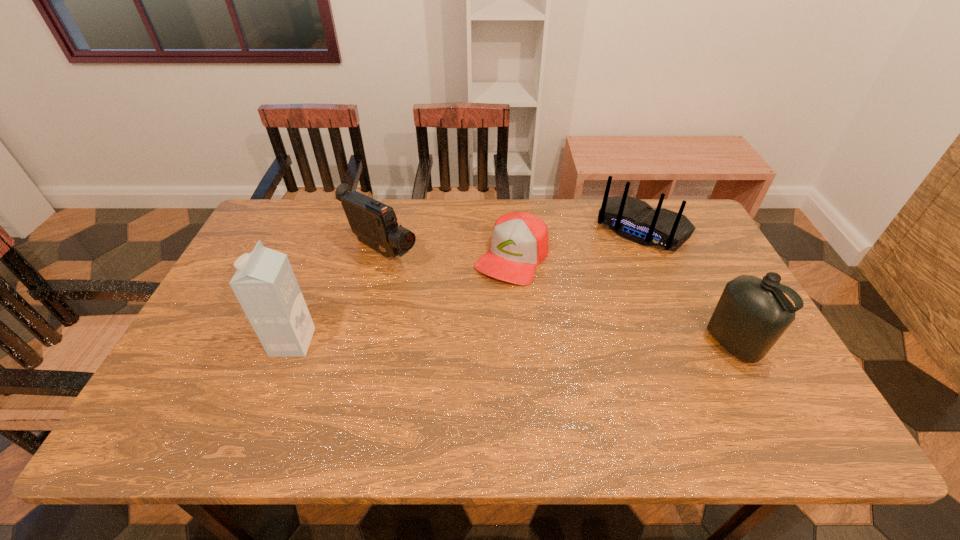
Locate an element on the screen. This screenshot has width=960, height=540. the tallest object is located at coordinates (265, 285).

This screenshot has width=960, height=540. In order to click on bottle in this screenshot , I will do `click(752, 313)`.

The image size is (960, 540). Find the location of `router`. router is located at coordinates tap(635, 220).

At what (x,y) coordinates should I click in order to perform the action: click on the shortest object. Please return your answer as a coordinate pair (x, y). This screenshot has height=540, width=960. Looking at the image, I should click on (519, 242).

You are a GUI agent. You are given a task and a screenshot of the screen. Output one action in this format:
    pyautogui.click(x=<x>, y=<y>)
    Task: Click on the third object from left to right
    The width and height of the screenshot is (960, 540).
    Given the screenshot: What is the action you would take?
    pyautogui.click(x=519, y=242)

Where is `camcorder`? The width and height of the screenshot is (960, 540). camcorder is located at coordinates (375, 224).

At what (x,y) coordinates should I click in order to perform the action: click on vacant space positioned 0.050m on the front label of the carton. Please return your answer as a coordinate pair (x, y). The image size is (960, 540). Looking at the image, I should click on (255, 342).

Locate an element on the screen. The image size is (960, 540). vacant space situated on the left of the fourth shortest object is located at coordinates (601, 344).

At what (x,y) coordinates should I click in order to perform the action: click on vacant space positioned 0.250m on the back of the router. Please return your answer as a coordinate pair (x, y). Image resolution: width=960 pixels, height=540 pixels. Looking at the image, I should click on (587, 300).

You are a GUI agent. You are given a task and a screenshot of the screen. Output one action in this format:
    pyautogui.click(x=<x>, y=<y>)
    Task: Click on the vacant space located 0.170m on the back of the router
    
    Given the screenshot: What is the action you would take?
    tap(599, 284)